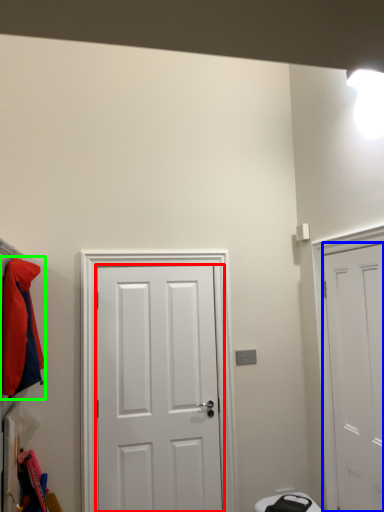
Question: Based on their relative distances, which object is nearer to door (highlighted by a red box)? Choose from door (highlighted by a blue box) and jacket (highlighted by a green box).

Choices:
 (A) door
 (B) jacket

Answer: (B)